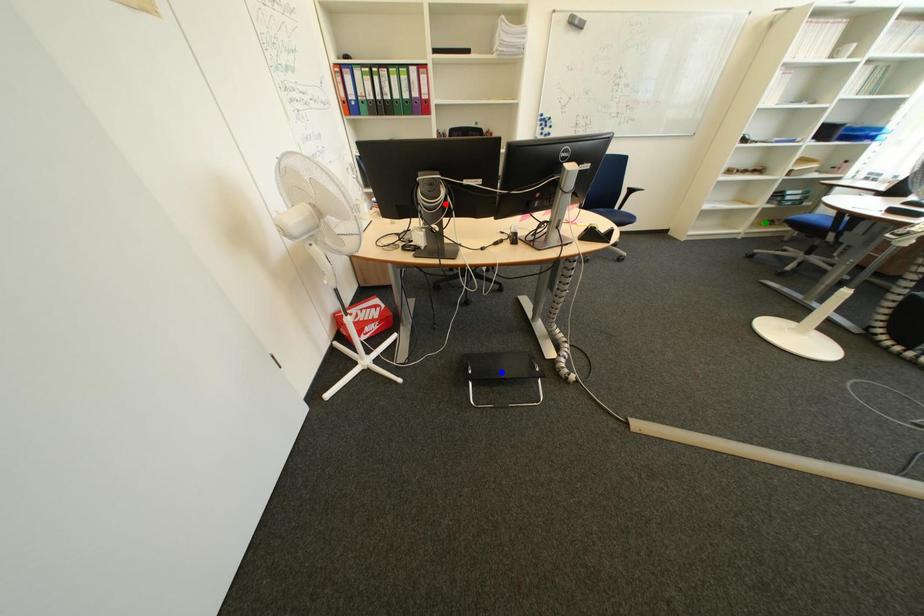
Order these from farthest to nearest:
blue point | red point | green point

green point
blue point
red point